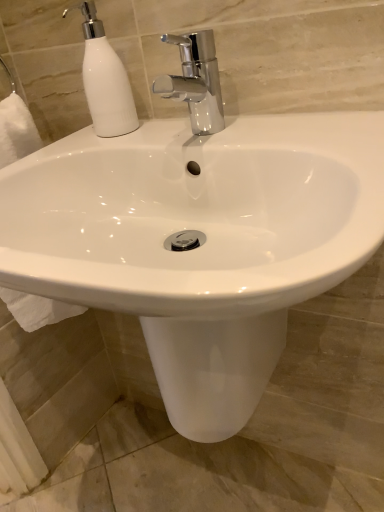
Question: Can you confirm if chrome metallic faucet at upper center is bigger than white matte soap dispenser at upper left?

Choices:
 (A) yes
 (B) no

Answer: (A)

Question: Is chrome metallic faucet at upper center to the right of white matte soap dispenser at upper left from the viewer's perspective?

Choices:
 (A) no
 (B) yes

Answer: (B)

Question: Is chrome metallic faucet at upper center wider than white matte soap dispenser at upper left?

Choices:
 (A) yes
 (B) no

Answer: (A)

Question: Could white matte soap dispenser at upper left be considered to be inside chrome metallic faucet at upper center?

Choices:
 (A) yes
 (B) no

Answer: (B)

Question: Is chrome metallic faucet at upper center in front of white matte soap dispenser at upper left?

Choices:
 (A) yes
 (B) no

Answer: (A)

Question: Is chrome metallic faucet at upper center facing away from white matte soap dispenser at upper left?

Choices:
 (A) yes
 (B) no

Answer: (B)

Question: Can you confirm if white matte soap dispenser at upper left is smaller than chrome metallic faucet at upper center?

Choices:
 (A) yes
 (B) no

Answer: (A)

Question: Is chrome metallic faucet at upper center located within white matte soap dispenser at upper left?

Choices:
 (A) no
 (B) yes

Answer: (A)

Question: Can you confirm if white matte soap dispenser at upper left is wider than chrome metallic faucet at upper center?

Choices:
 (A) yes
 (B) no

Answer: (B)

Question: Does white matte soap dispenser at upper left appear on the right side of chrome metallic faucet at upper center?

Choices:
 (A) no
 (B) yes

Answer: (A)

Question: From a real-world perspective, is white matte soap dispenser at upper left located beneath chrome metallic faucet at upper center?

Choices:
 (A) yes
 (B) no

Answer: (B)

Question: Considering the relative sizes of white matte soap dispenser at upper left and chrome metallic faucet at upper center in the image provided, is white matte soap dispenser at upper left bigger than chrome metallic faucet at upper center?

Choices:
 (A) no
 (B) yes

Answer: (A)

Question: Considering the positions of white matte soap dispenser at upper left and chrome metallic faucet at upper center in the image, is white matte soap dispenser at upper left wider or thinner than chrome metallic faucet at upper center?

Choices:
 (A) thin
 (B) wide

Answer: (A)